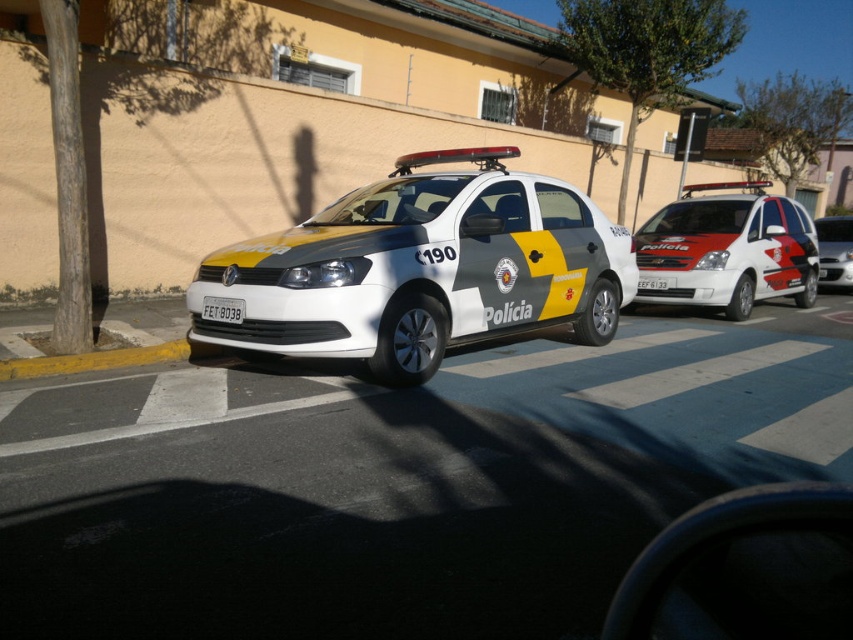
You are a pedestrian standing on the sidewalk and see the white glossy van at right and the white plastic license plate at center. Which object is closer to you?

The white glossy van at right is closer to you because the white plastic license plate at center is behind it.

You are a pedestrian standing at the point with coordinates point (422,268) in the street scene. What object are you standing on?

The point (422,268) corresponds to the white glossy police car at center, so you are standing on the white glossy police car at center.

You are a pedestrian standing on the sidewalk and see the white glossy van at right and the white plastic license plate at center. Which one is located to the right of the other?

The white glossy van at right is positioned on the right side of white plastic license plate at center.